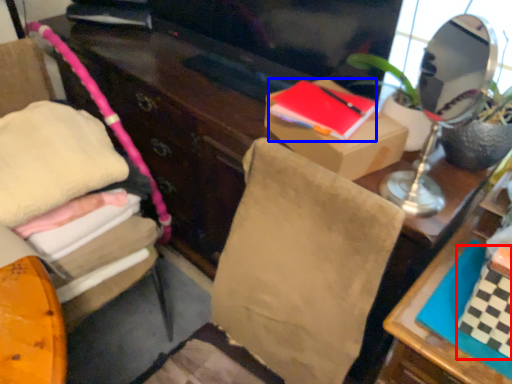
Question: Which object appears closest to the camera in this image, book (highlighted by a red box) or book (highlighted by a blue box)?

Choices:
 (A) book
 (B) book

Answer: (A)